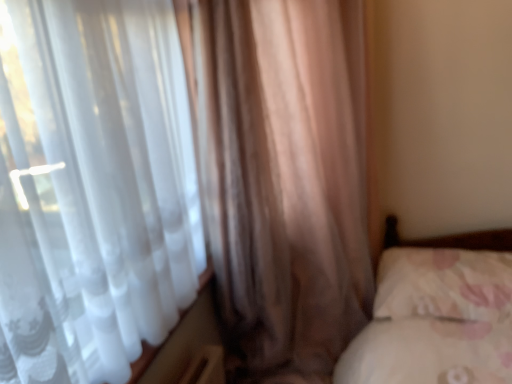
Question: Does satin brown curtain at left, the second curtain positioned from the right, have a lesser height compared to translucent fabric curtain at left, the 2th curtain viewed from the left?

Choices:
 (A) no
 (B) yes

Answer: (A)

Question: Is satin brown curtain at left, placed as the 1th curtain when sorted from left to right, with translucent fabric curtain at left, the 2th curtain viewed from the left?

Choices:
 (A) yes
 (B) no

Answer: (B)

Question: From a real-world perspective, is satin brown curtain at left, the second curtain positioned from the right, beneath translucent fabric curtain at left, the first curtain when ordered from right to left?

Choices:
 (A) no
 (B) yes

Answer: (B)

Question: Does satin brown curtain at left, the second curtain positioned from the right, have a larger size compared to translucent fabric curtain at left, the 2th curtain viewed from the left?

Choices:
 (A) yes
 (B) no

Answer: (A)

Question: Is satin brown curtain at left, placed as the 1th curtain when sorted from left to right, taller than translucent fabric curtain at left, the 2th curtain viewed from the left?

Choices:
 (A) yes
 (B) no

Answer: (A)

Question: From a real-world perspective, relative to satin brown curtain at left, placed as the 1th curtain when sorted from left to right, is fluffy white pillow at lower right vertically above or below?

Choices:
 (A) above
 (B) below

Answer: (B)

Question: Is fluffy white pillow at lower right to the left or to the right of satin brown curtain at left, placed as the 1th curtain when sorted from left to right, in the image?

Choices:
 (A) left
 (B) right

Answer: (B)

Question: From their relative heights in the image, would you say fluffy white pillow at lower right is taller or shorter than satin brown curtain at left, the second curtain positioned from the right?

Choices:
 (A) tall
 (B) short

Answer: (B)

Question: In terms of width, does fluffy white pillow at lower right look wider or thinner when compared to satin brown curtain at left, the second curtain positioned from the right?

Choices:
 (A) wide
 (B) thin

Answer: (B)

Question: From their relative heights in the image, would you say fluffy white pillow at lower right is taller or shorter than translucent fabric curtain at left, the 2th curtain viewed from the left?

Choices:
 (A) tall
 (B) short

Answer: (B)

Question: Do you think fluffy white pillow at lower right is within translucent fabric curtain at left, the first curtain when ordered from right to left, or outside of it?

Choices:
 (A) outside
 (B) inside

Answer: (A)

Question: From the image's perspective, relative to translucent fabric curtain at left, the first curtain when ordered from right to left, is fluffy white pillow at lower right above or below?

Choices:
 (A) above
 (B) below

Answer: (B)

Question: Considering the relative positions of fluffy white pillow at lower right and translucent fabric curtain at left, the 2th curtain viewed from the left, in the image provided, is fluffy white pillow at lower right to the left or to the right of translucent fabric curtain at left, the 2th curtain viewed from the left,?

Choices:
 (A) left
 (B) right

Answer: (B)

Question: In terms of height, does translucent fabric curtain at left, the 2th curtain viewed from the left, look taller or shorter compared to fluffy white pillow at lower right?

Choices:
 (A) tall
 (B) short

Answer: (A)

Question: Considering the positions of translucent fabric curtain at left, the first curtain when ordered from right to left, and fluffy white pillow at lower right in the image, is translucent fabric curtain at left, the first curtain when ordered from right to left, wider or thinner than fluffy white pillow at lower right?

Choices:
 (A) thin
 (B) wide

Answer: (A)